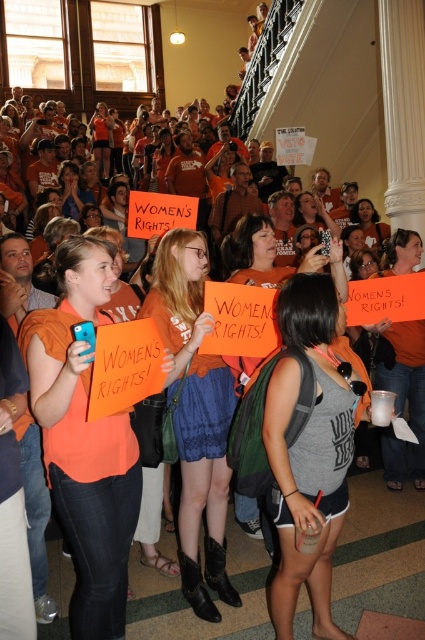
You are a photographer trying to capture a clear shot of both the orange matte shirt at center and the orange matte sign at center. Since you want both in focus, you need to know their positions relative to each other. Can you determine which one is to the left of the other?

The orange matte shirt at center is positioned on the left side of the orange matte sign at center.

You are a photographer standing at the point marked as point (x=309, y=451). You want to capture a photo of the gray cotton tank top at center. Is the gray cotton tank top at center visible from your current position?

The gray cotton tank top at center is located at point (x=309, y=451), so yes, it is visible from your current position.

You are a photographer standing at the back of the crowd. You want to take a photo of the orange matte sign at center without the gray cotton tank top at center blocking it. Is it possible to do so given their distance apart?

The gray cotton tank top at center is 2.64 meters away from the orange matte sign at center. Since the distance between them is relatively large, it is possible to position yourself in a way that avoids the gray cotton tank top at center blocking the orange matte sign at center in the photo.